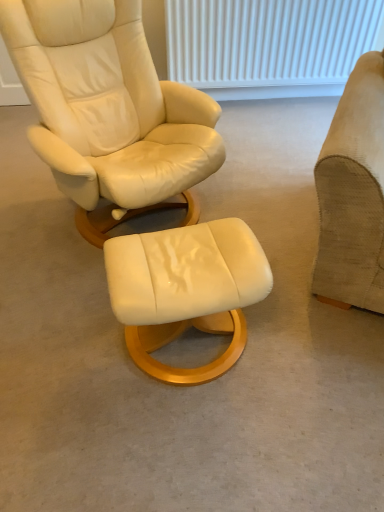
Question: Is suede beige armchair at right inside the boundaries of white textured radiator at upper center, or outside?

Choices:
 (A) outside
 (B) inside

Answer: (A)

Question: Relative to white textured radiator at upper center, is suede beige armchair at right in front or behind?

Choices:
 (A) behind
 (B) front

Answer: (B)

Question: Which object is positioned closest to the white textured radiator at upper center?

Choices:
 (A) suede beige armchair at right
 (B) matte cream leather stool at center

Answer: (A)

Question: Estimate the real-world distances between objects in this image. Which object is closer to the white textured radiator at upper center?

Choices:
 (A) matte cream leather stool at center
 (B) suede beige armchair at right

Answer: (B)